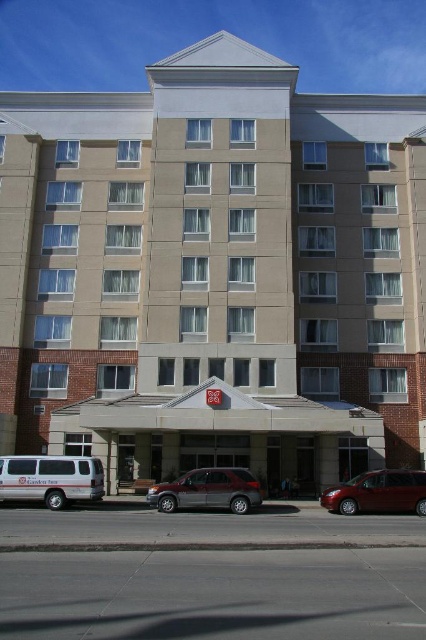
Does white van at lower left appear under glossy metallic minivan at lower right?

No, white van at lower left is not below glossy metallic minivan at lower right.

The image size is (426, 640). What are the coordinates of `white van at lower left` in the screenshot? It's located at (51, 477).

This screenshot has height=640, width=426. I want to click on white van at lower left, so click(51, 477).

Is point (281, 170) farther from camera compared to point (357, 490)?

Yes.

Locate an element on the screen. This screenshot has height=640, width=426. beige concrete building at center is located at coordinates (213, 273).

Between white van at lower left and silver metallic minivan at center, which one is positioned lower?

silver metallic minivan at center is below.

Between point (52, 472) and point (157, 496), which one is positioned behind?

Positioned behind is point (157, 496).

You are a GUI agent. You are given a task and a screenshot of the screen. Output one action in this format:
    pyautogui.click(x=<x>, y=<y>)
    Task: Click on the white van at lower left
    This screenshot has height=640, width=426.
    Given the screenshot: What is the action you would take?
    pyautogui.click(x=51, y=477)